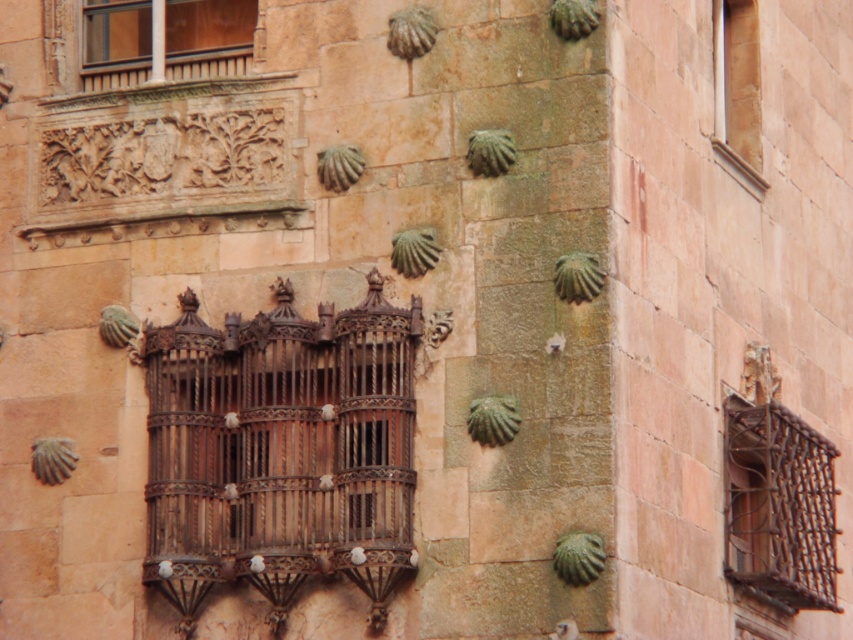
Which is in front, point (125, 49) or point (746, 156)?

Point (125, 49)

Who is more distant from viewer, [177,35] or [743,67]?

The point [743,67] is more distant.

At what (x,y) coordinates should I click in order to perform the action: click on matte glass window at upper left. Please return your answer as a coordinate pair (x, y). The image size is (853, 640). Looking at the image, I should click on (207, 36).

Is rusty metal balcony at right to the left of matte glass window at upper left from the viewer's perspective?

No, rusty metal balcony at right is not to the left of matte glass window at upper left.

Who is more forward, (x=769, y=477) or (x=132, y=67)?

Point (x=769, y=477) is in front.

Who is more forward, (779,458) or (180,0)?

Point (779,458)

At what (x,y) coordinates should I click in order to perform the action: click on rusty metal balcony at right. Please return your answer as a coordinate pair (x, y). This screenshot has width=853, height=640. Looking at the image, I should click on (778, 506).

Does rusty metal balcony at right appear under matte brown wood at upper right?

Indeed, rusty metal balcony at right is positioned under matte brown wood at upper right.

Who is lower down, rusty metal balcony at right or matte brown wood at upper right?

rusty metal balcony at right

Is point (724, 541) more distant than point (735, 125)?

No.

The width and height of the screenshot is (853, 640). I want to click on rusty metal balcony at right, so click(778, 506).